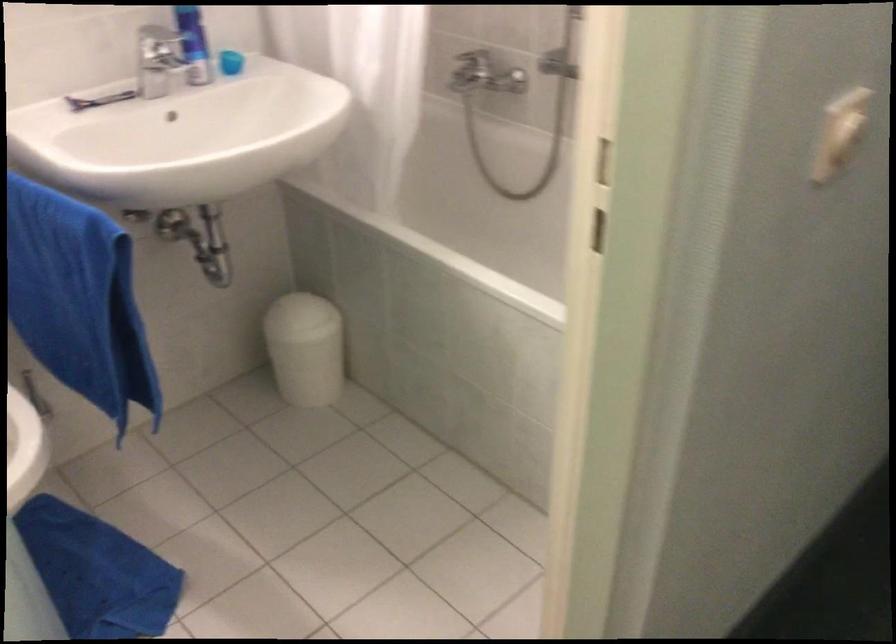
Identify the location of silver faucet handle. (161, 59).